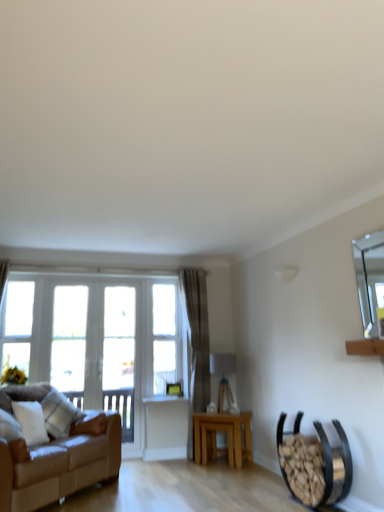
This screenshot has height=512, width=384. I want to click on vacant space situated above clear glass window at left, placed as the 1th window when sorted from left to right (from a real-world perspective), so click(28, 272).